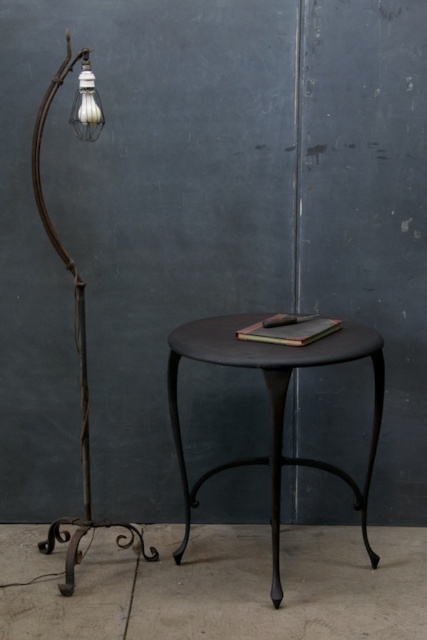
Question: Does matte black table at center appear on the left side of rustic wrought iron floor lamp at left?

Choices:
 (A) yes
 (B) no

Answer: (B)

Question: Which point is closer to the camera taking this photo?

Choices:
 (A) (82, 97)
 (B) (193, 486)

Answer: (A)

Question: Is matte black table at center below rustic wrought iron floor lamp at left?

Choices:
 (A) yes
 (B) no

Answer: (A)

Question: Is matte black table at center bigger than matte white bulb at upper left?

Choices:
 (A) no
 (B) yes

Answer: (B)

Question: Which object is closer to the camera taking this photo?

Choices:
 (A) matte white bulb at upper left
 (B) rustic wrought iron floor lamp at left

Answer: (A)

Question: Which object appears closest to the camera in this image?

Choices:
 (A) matte black table at center
 (B) rustic wrought iron floor lamp at left
 (C) matte white bulb at upper left

Answer: (A)